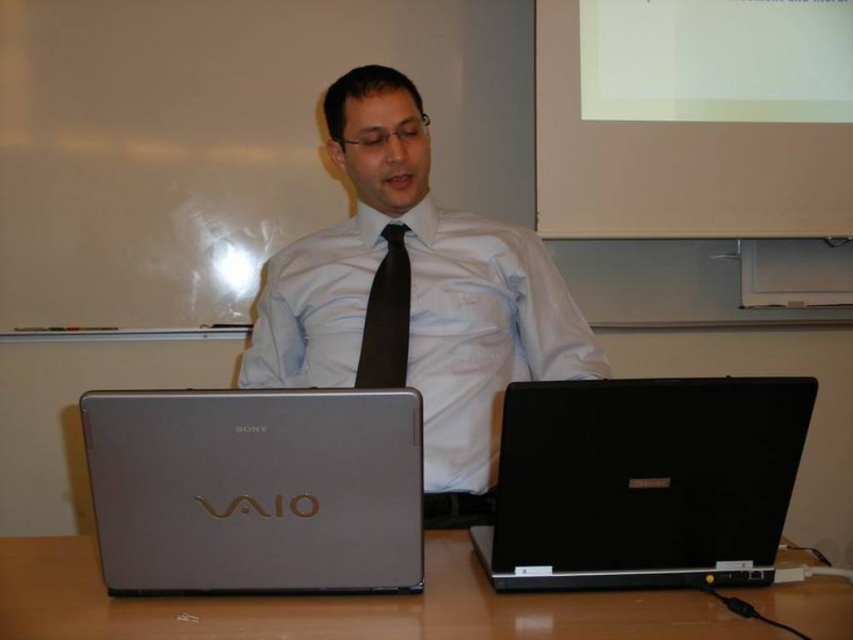
You are organizing a presentation and need to place the silver metallic vaio laptop at center and the black satin tie at center on a shelf. If the shelf has limited space, which object should you place first to ensure both fit?

The silver metallic vaio laptop at center is wider than the black satin tie at center, so you should place the silver metallic vaio laptop at center first to ensure both fit on the shelf.

You are organizing a tech event and need to place two laptops on a table. The matte silver laptop at center and the black matte laptop at lower right are available. If you want to ensure that the larger laptop is placed in a position where it can be easily seen by the audience, which one should you choose?

The matte silver laptop at center is bigger than the black matte laptop at lower right, so you should choose the matte silver laptop at center to place in a position where it can be easily seen by the audience.

You are an assistant at a tech conference. You need to set up two laptops for a presentation. The laptops are the matte silver laptop at center and the silver metallic vaio laptop at center. The presenter mentioned that the taller laptop should be placed on the left side for better visibility. Which laptop should you place on the left?

The matte silver laptop at center is taller than the silver metallic vaio laptop at center, so you should place the matte silver laptop at center on the left side as requested.